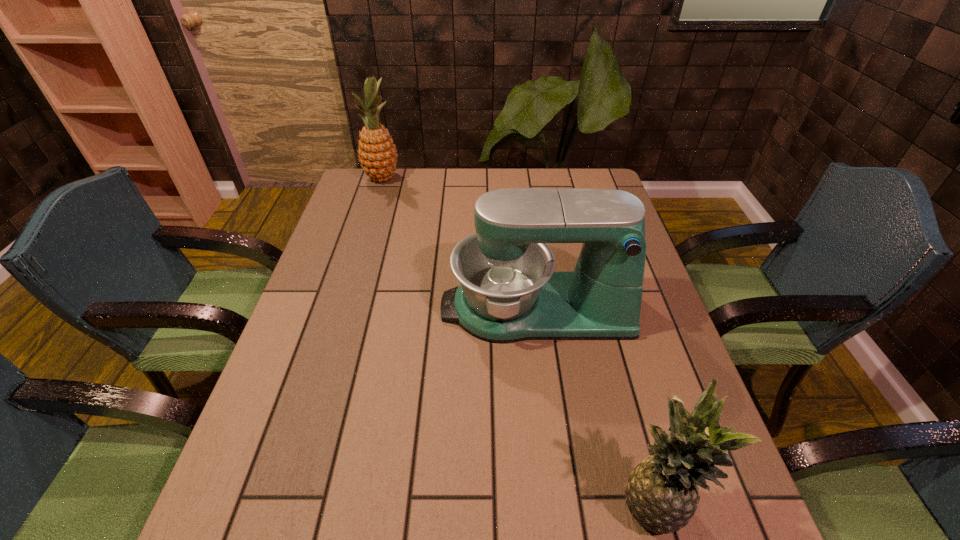
Where is `object located at the far left corner`? The width and height of the screenshot is (960, 540). object located at the far left corner is located at coordinates (377, 154).

Identify the location of free location at the far edge. (411, 174).

You are a GUI agent. You are given a task and a screenshot of the screen. Output one action in this format:
    pyautogui.click(x=<x>, y=<y>)
    Task: Click on the vacant point at the near edge
    
    Given the screenshot: What is the action you would take?
    pyautogui.click(x=544, y=525)

At what (x,y) coordinates should I click in order to perform the action: click on blank space at the left edge of the desktop. Please return your answer as a coordinate pair (x, y). Looking at the image, I should click on (291, 333).

In the image, there is a desktop. Identify the location of vacant space at the right edge. (643, 408).

Locate which object is the closest to the second farthest object. Please provide its 2D coordinates. Your answer should be formatted as a tuple, i.e. [(x, y)], where the tuple contains the x and y coordinates of a point satisfying the conditions above.

[(662, 494)]

I want to click on object that is the second closest to the farthest object, so click(x=662, y=494).